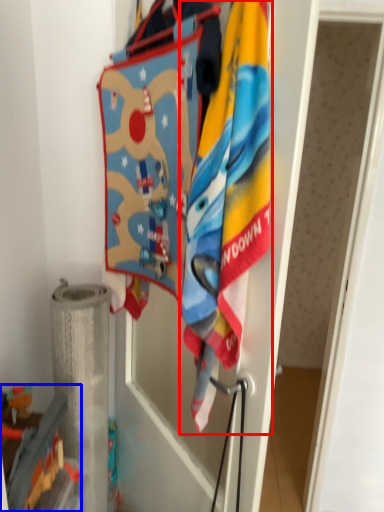
Question: Which point is further to the camera, towel (highlighted by a red box) or toy (highlighted by a blue box)?

Choices:
 (A) towel
 (B) toy

Answer: (B)